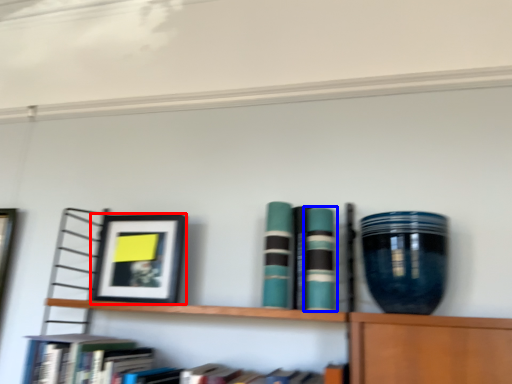
Question: Which object appears closest to the camera in this image, picture frame (highlighted by a red box) or book (highlighted by a blue box)?

Choices:
 (A) picture frame
 (B) book

Answer: (B)